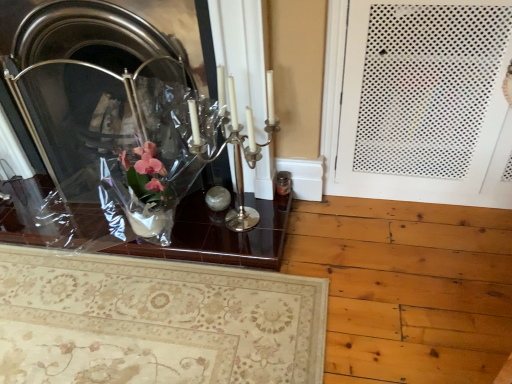
Question: Is shiny glass table at center taller or shorter than white perforated door at right?

Choices:
 (A) tall
 (B) short

Answer: (B)

Question: Considering their positions, is shiny glass table at center located in front of or behind white perforated door at right?

Choices:
 (A) behind
 (B) front

Answer: (A)

Question: Which object is positioned farthest from the white perforated door at right?

Choices:
 (A) clear glass fireplace at upper left
 (B) shiny glass table at center

Answer: (A)

Question: Which is farther from the shiny glass table at center?

Choices:
 (A) white perforated door at right
 (B) clear glass fireplace at upper left

Answer: (A)